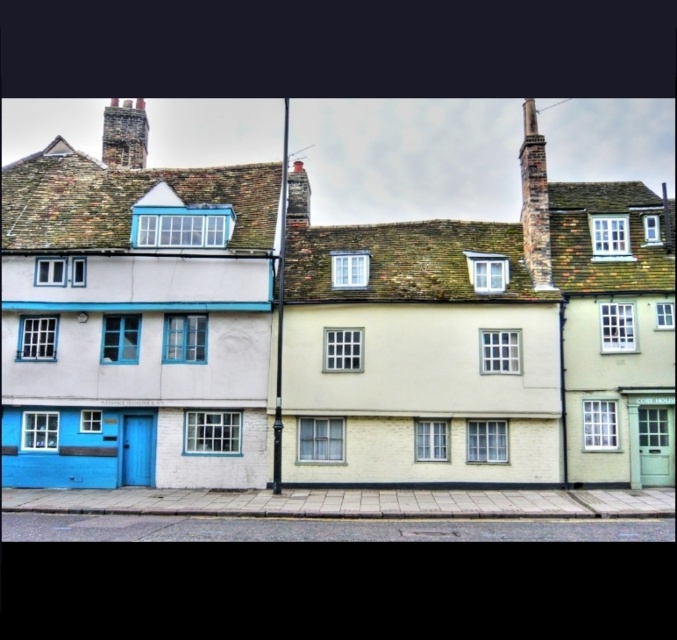
You are standing in front of the row of terraced houses and want to place a new satellite dish on the roof. The dish needs to be installed above the smooth brick chimney at center. Can you install it above the rustic brick chimney at upper right?

The rustic brick chimney at upper right is located below the smooth brick chimney at center, so yes, you can install the satellite dish above the smooth brick chimney at center since it is positioned higher up on the roof.

You are a drone operator flying a drone that needs to pass between the rustic stone chimney at upper left and the smooth brick chimney at center. Given that your drone can only fly at a maximum height of 1.2 meters, will it be able to navigate between them without hitting either chimney?

The rustic stone chimney at upper left is taller than the smooth brick chimney at center. Since the drone can only fly at 1.2 meters, it may not be able to navigate between them without hitting the taller rustic stone chimney at upper left unless the distance between the chimneys allows for a safe passage under both. However, the exact clearance isn

You are a drone operator tasked with flying a drone between two points in the scene. The drone has a maximum flight distance of 25 meters. You need to fly the drone from the rustic brick chimney at upper right to the nearest house. Will the drone be able to complete the flight without exceeding its maximum distance?

The distance between the rustic brick chimney at upper right and the nearest house is 24.35 meters, which is within the drone operator maximum flight distance of 25 meters. The drone can complete the flight without exceeding its limit.